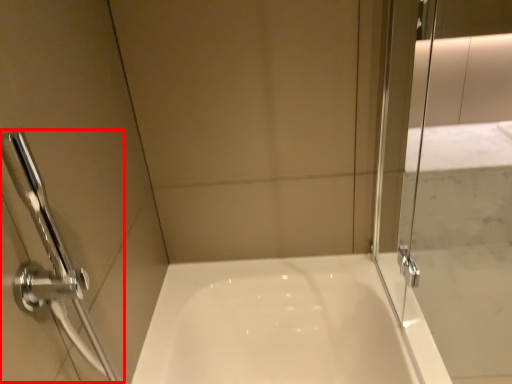
Question: From the image's perspective, where is shower (annotated by the red box) located relative to screen door?

Choices:
 (A) above
 (B) below

Answer: (B)